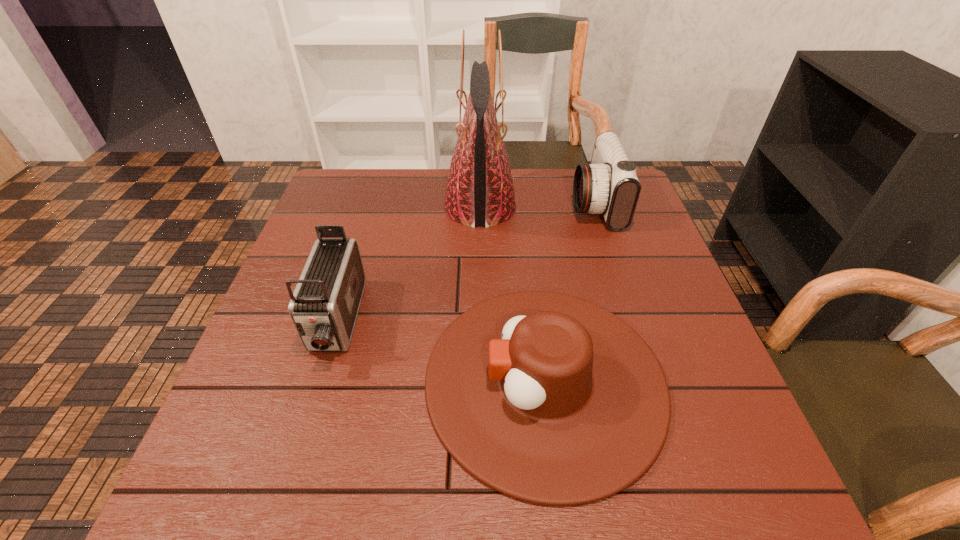
Locate an element on the screen. The width and height of the screenshot is (960, 540). free area in between the right camcorder and the handbag is located at coordinates (538, 206).

The image size is (960, 540). What are the coordinates of `free point between the leftmost object and the tallest object` in the screenshot? It's located at (408, 265).

Locate an element on the screen. free space between the shortest object and the right camcorder is located at coordinates (570, 292).

This screenshot has width=960, height=540. What are the coordinates of `free area in between the shortest object and the farther camcorder` in the screenshot? It's located at (570, 292).

Identify which object is located as the third nearest to the cowboy hat. Please provide its 2D coordinates. Your answer should be formatted as a tuple, i.e. [(x, y)], where the tuple contains the x and y coordinates of a point satisfying the conditions above.

[(609, 185)]

Identify which object is located as the second nearest to the shortest object. Please provide its 2D coordinates. Your answer should be formatted as a tuple, i.e. [(x, y)], where the tuple contains the x and y coordinates of a point satisfying the conditions above.

[(479, 191)]

Find the location of a particular element. The image size is (960, 540). vacant area that satisfies the following two spatial constraints: 1. on the surface of the right camcorder; 2. on the front side of the tallest object is located at coordinates (596, 208).

I want to click on free region that satisfies the following two spatial constraints: 1. on the surface of the right camcorder; 2. at the lens of the leftmost object, so click(633, 322).

Locate an element on the screen. vacant position in the image that satisfies the following two spatial constraints: 1. on the surface of the right camcorder; 2. on the front side of the handbag is located at coordinates (596, 208).